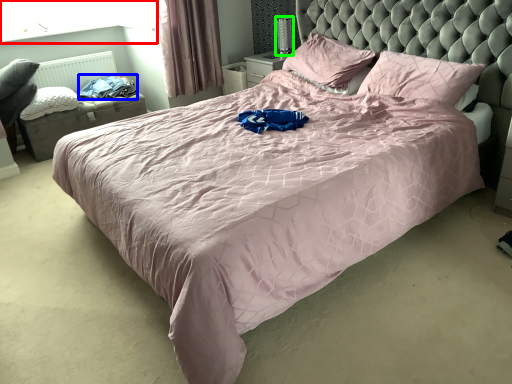
Question: Estimate the real-world distances between objects in this image. Which object is closer to window screen (highlighted by a red box), clothing (highlighted by a blue box) or table lamp (highlighted by a green box)?

Choices:
 (A) clothing
 (B) table lamp

Answer: (A)